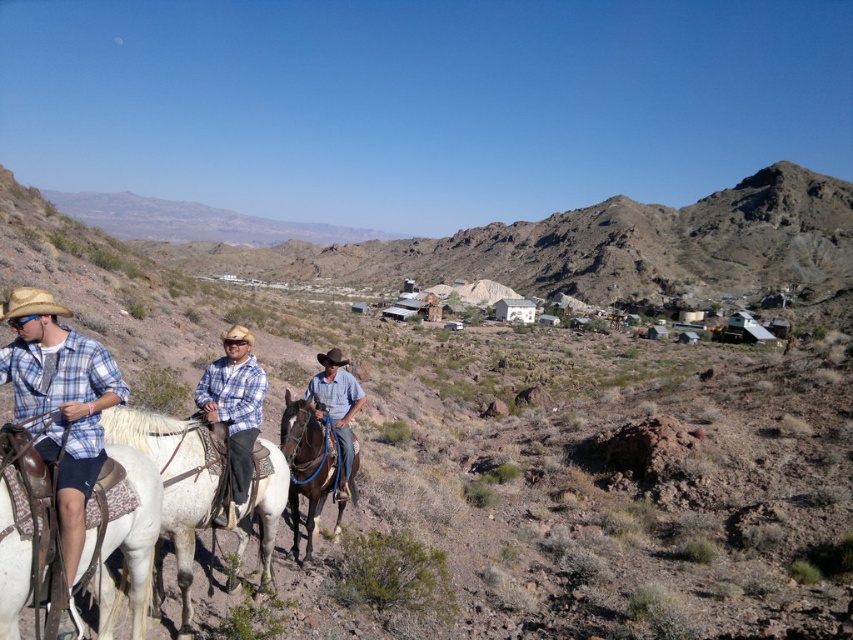
Does white leather boots at lower left appear over white matte horse at left?

Indeed, white leather boots at lower left is positioned over white matte horse at left.

Based on the photo, does white leather boots at lower left appear on the left side of white matte horse at left?

In fact, white leather boots at lower left is to the right of white matte horse at left.

You are a GUI agent. You are given a task and a screenshot of the screen. Output one action in this format:
    pyautogui.click(x=<x>, y=<y>)
    Task: Click on the white leather boots at lower left
    
    Given the screenshot: What is the action you would take?
    pyautogui.click(x=73, y=408)

Which is in front, point (0, 586) or point (242, 330)?

Point (0, 586)

Is point (117, 541) less distant than point (236, 452)?

Yes, point (117, 541) is closer to viewer.

This screenshot has height=640, width=853. What do you see at coordinates (136, 531) in the screenshot? I see `white matte horse at left` at bounding box center [136, 531].

Locate an element on the screen. This screenshot has height=640, width=853. white matte horse at left is located at coordinates (136, 531).

Who is taller, white leather saddle at center or white matte horse at left?

Standing taller between the two is white leather saddle at center.

Is white leather saddle at center above white matte horse at left?

Yes.

Is point (172, 461) positioned in front of point (146, 509)?

No, (172, 461) is further to viewer.

The image size is (853, 640). What are the coordinates of `white leather saddle at center` in the screenshot? It's located at (173, 481).